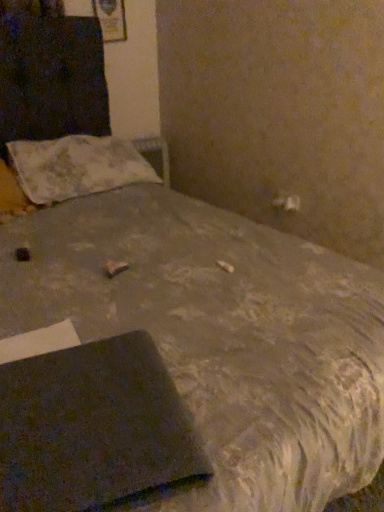
What is the approximate width of dark gray matte notebook at lower left?

It is 15.73 inches.

This screenshot has width=384, height=512. What do you see at coordinates (93, 428) in the screenshot?
I see `dark gray matte notebook at lower left` at bounding box center [93, 428].

Where is `dark gray matte notebook at lower left`? This screenshot has height=512, width=384. dark gray matte notebook at lower left is located at coordinates (93, 428).

The image size is (384, 512). I want to click on fluffy white pillow at upper left, so click(77, 167).

What do you see at coordinates (77, 167) in the screenshot? I see `fluffy white pillow at upper left` at bounding box center [77, 167].

What is the approximate height of fluffy white pillow at upper left?

The height of fluffy white pillow at upper left is 28.37 centimeters.

The width and height of the screenshot is (384, 512). What are the coordinates of `dark gray matte notebook at lower left` in the screenshot? It's located at (93, 428).

Can you confirm if fluffy white pillow at upper left is positioned to the left of dark gray matte notebook at lower left?

Yes, fluffy white pillow at upper left is to the left of dark gray matte notebook at lower left.

Does fluffy white pillow at upper left come in front of dark gray matte notebook at lower left?

No, it is behind dark gray matte notebook at lower left.

Does point (126, 169) appear closer or farther from the camera than point (100, 419)?

Point (126, 169).

From the image's perspective, is fluffy white pillow at upper left located beneath dark gray matte notebook at lower left?

No, from the image's perspective, fluffy white pillow at upper left is not beneath dark gray matte notebook at lower left.

From a real-world perspective, is fluffy white pillow at upper left positioned above or below dark gray matte notebook at lower left?

fluffy white pillow at upper left is situated higher than dark gray matte notebook at lower left in the real world.

Considering the relative sizes of fluffy white pillow at upper left and dark gray matte notebook at lower left in the image provided, is fluffy white pillow at upper left wider than dark gray matte notebook at lower left?

Yes, fluffy white pillow at upper left is wider than dark gray matte notebook at lower left.

Is fluffy white pillow at upper left shorter than dark gray matte notebook at lower left?

Incorrect, the height of fluffy white pillow at upper left does not fall short of that of dark gray matte notebook at lower left.

Based on the photo, considering the relative sizes of fluffy white pillow at upper left and dark gray matte notebook at lower left in the image provided, is fluffy white pillow at upper left bigger than dark gray matte notebook at lower left?

Correct, fluffy white pillow at upper left is larger in size than dark gray matte notebook at lower left.

Can dark gray matte notebook at lower left be found inside fluffy white pillow at upper left?

That's incorrect, dark gray matte notebook at lower left is not inside fluffy white pillow at upper left.

Are fluffy white pillow at upper left and dark gray matte notebook at lower left beside each other?

They are not placed beside each other.

Is dark gray matte notebook at lower left at the back of fluffy white pillow at upper left?

No, fluffy white pillow at upper left is not facing the opposite direction of dark gray matte notebook at lower left.

Where is `pillow above the dark gray matte notebook at lower left (from a real-world perspective)`? pillow above the dark gray matte notebook at lower left (from a real-world perspective) is located at coordinates (77, 167).

Considering the positions of objects dark gray matte notebook at lower left and fluffy white pillow at upper left in the image provided, who is more to the right, dark gray matte notebook at lower left or fluffy white pillow at upper left?

dark gray matte notebook at lower left is more to the right.

Is the depth of dark gray matte notebook at lower left greater than that of fluffy white pillow at upper left?

No, it is not.

Considering the positions of points (141, 404) and (54, 143), is point (141, 404) farther from camera compared to point (54, 143)?

That is False.

From the image's perspective, which one is positioned higher, dark gray matte notebook at lower left or fluffy white pillow at upper left?

fluffy white pillow at upper left, from the image's perspective.

From a real-world perspective, is dark gray matte notebook at lower left above or below fluffy white pillow at upper left?

From a real-world perspective, dark gray matte notebook at lower left is physically below fluffy white pillow at upper left.

In terms of width, does dark gray matte notebook at lower left look wider or thinner when compared to fluffy white pillow at upper left?

In the image, dark gray matte notebook at lower left appears to be more narrow than fluffy white pillow at upper left.

Is dark gray matte notebook at lower left taller or shorter than fluffy white pillow at upper left?

dark gray matte notebook at lower left is shorter than fluffy white pillow at upper left.

Can you confirm if dark gray matte notebook at lower left is smaller than fluffy white pillow at upper left?

Indeed, dark gray matte notebook at lower left has a smaller size compared to fluffy white pillow at upper left.

Is dark gray matte notebook at lower left not inside fluffy white pillow at upper left?

Yes, dark gray matte notebook at lower left is outside of fluffy white pillow at upper left.

Is dark gray matte notebook at lower left next to fluffy white pillow at upper left?

dark gray matte notebook at lower left and fluffy white pillow at upper left are clearly separated.

Is fluffy white pillow at upper left at the back of dark gray matte notebook at lower left?

Correct, dark gray matte notebook at lower left is looking away from fluffy white pillow at upper left.

The width and height of the screenshot is (384, 512). What are the coordinates of `pillow on the left of dark gray matte notebook at lower left` in the screenshot? It's located at (77, 167).

Where is `pillow located above the dark gray matte notebook at lower left (from a real-world perspective)`? The width and height of the screenshot is (384, 512). pillow located above the dark gray matte notebook at lower left (from a real-world perspective) is located at coordinates (77, 167).

This screenshot has width=384, height=512. Identify the location of notebook on the right of fluffy white pillow at upper left. (93, 428).